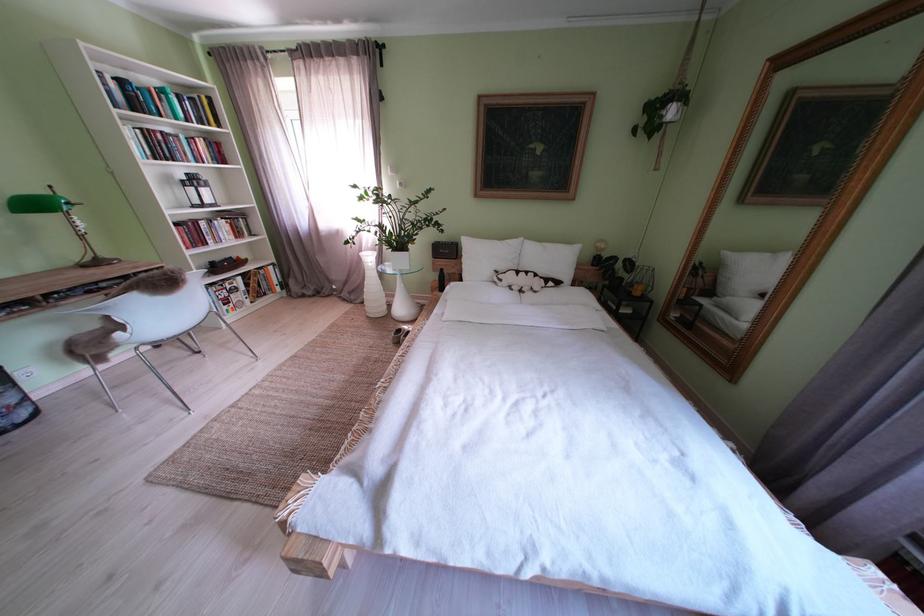
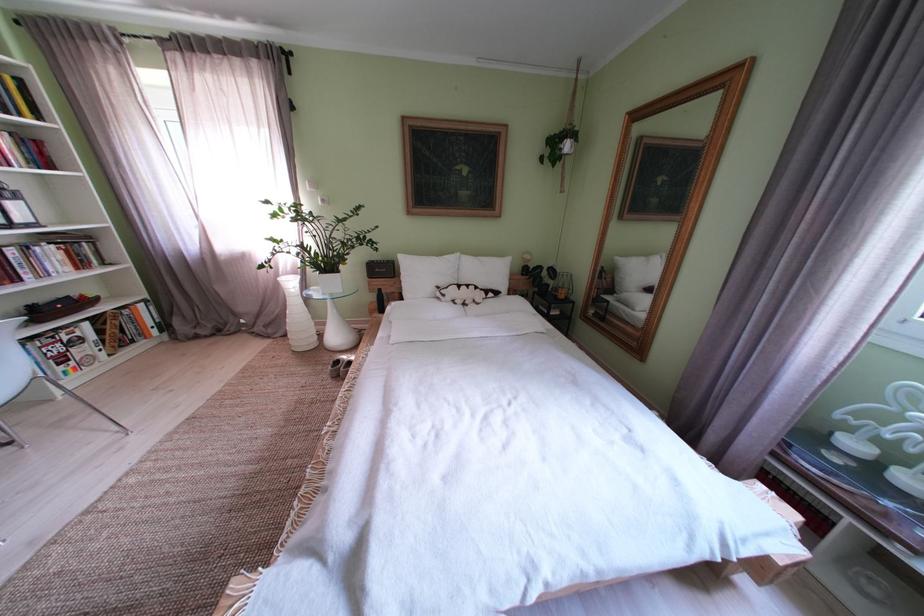
Where in the second image is the point corresponding to (512,285) from the first image?

(455, 301)